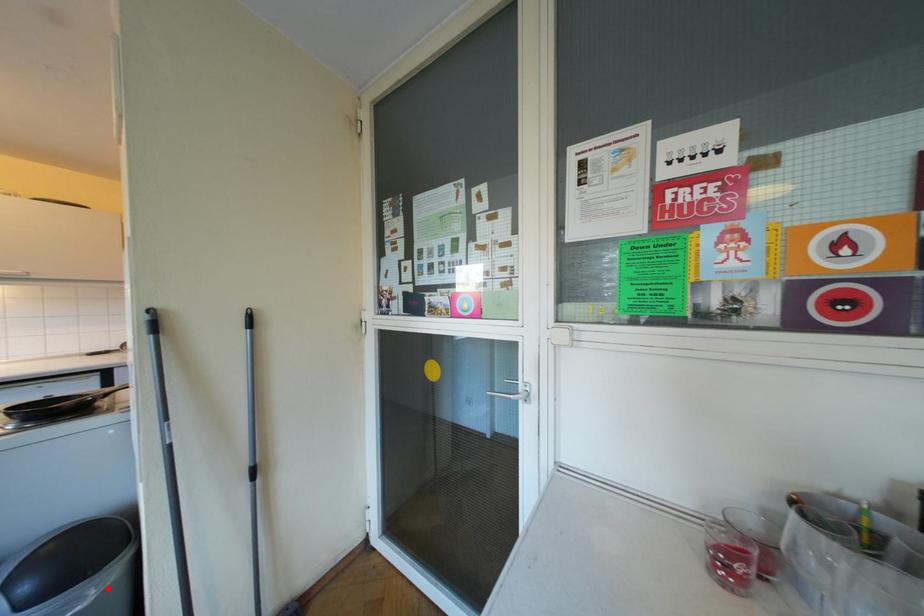
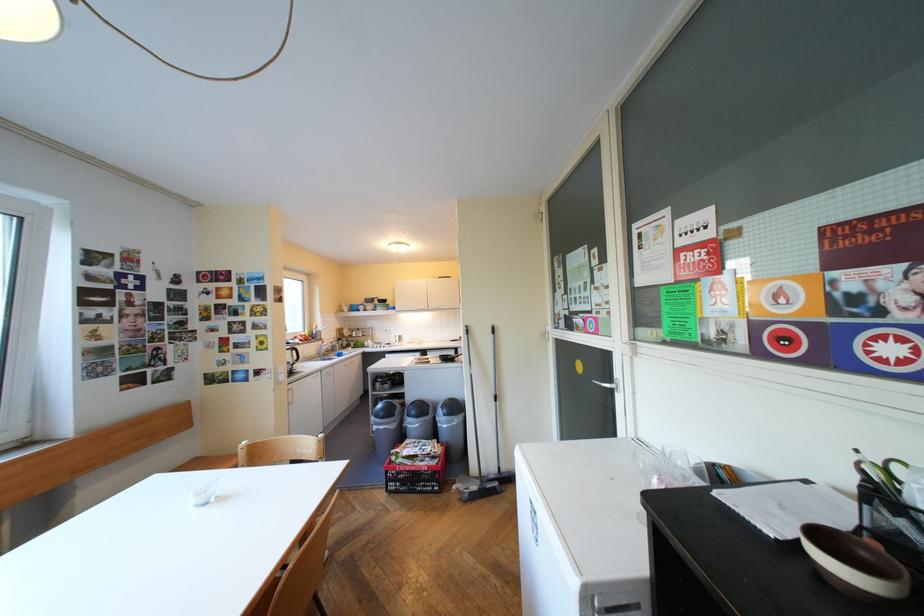
Question: A red point is marked in image1. In image2, is the corresponding 3D point closer to the camera or farther? Reply with the corresponding letter.

Choices:
 (A) The corresponding 3D point is closer.
 (B) The corresponding 3D point is farther.

Answer: (B)